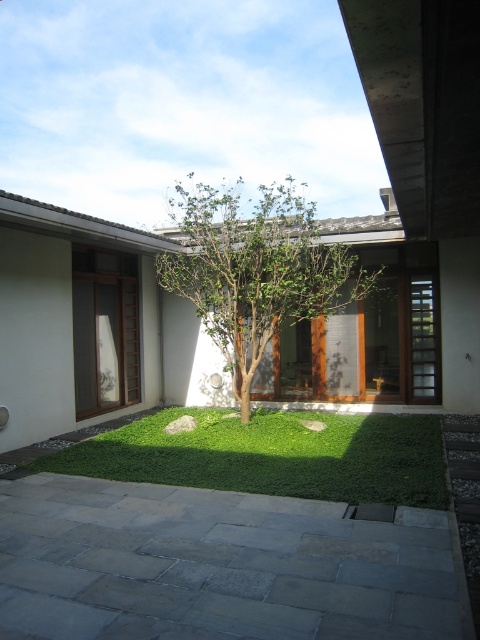
Can you confirm if green leafy grass at center is positioned to the right of green leafy tree at center?

In fact, green leafy grass at center is to the left of green leafy tree at center.

From the picture: Is green leafy grass at center below green leafy tree at center?

Correct, green leafy grass at center is located below green leafy tree at center.

I want to click on green leafy grass at center, so click(273, 456).